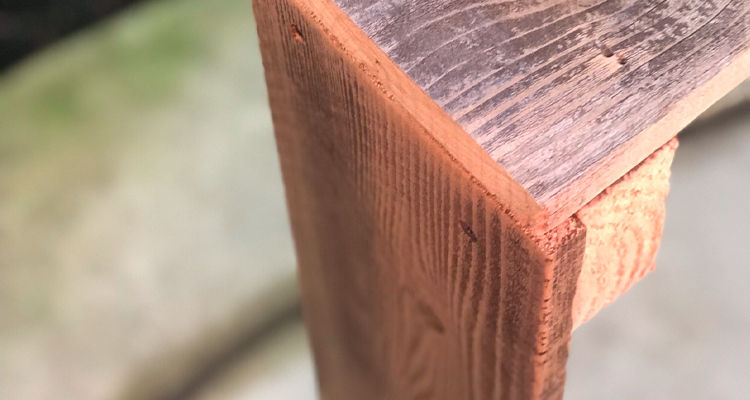
At what (x,y) coordinates should I click in order to perform the action: click on upright leg of wooden item. Please return your answer as a coordinate pair (x, y). Looking at the image, I should click on (380, 269).